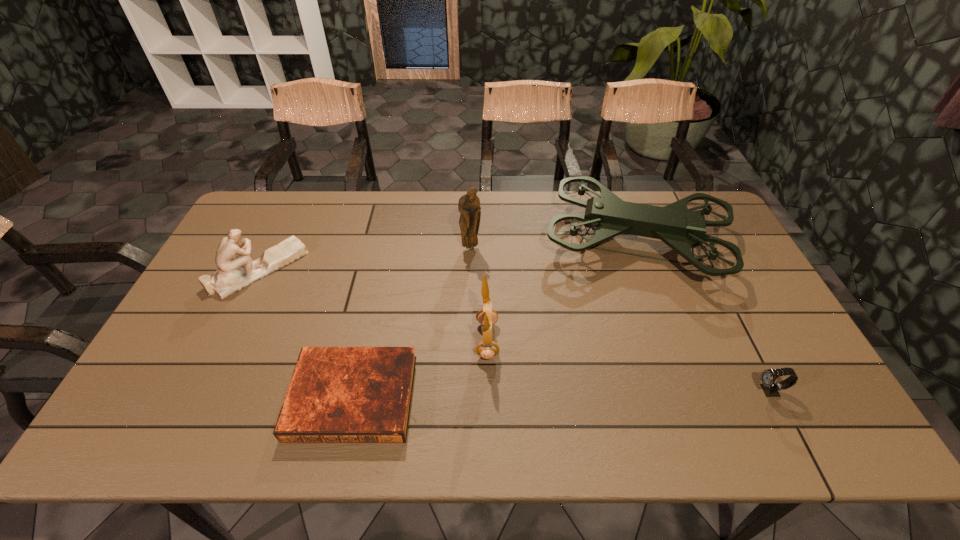
You are a GUI agent. You are given a task and a screenshot of the screen. Output one action in this format:
    pyautogui.click(x=<x>, y=<y>)
    Task: Click on the object located in the left edge section of the desktop
    
    Given the screenshot: What is the action you would take?
    pyautogui.click(x=236, y=270)

You are a GUI agent. You are given a task and a screenshot of the screen. Output one action in this format:
    pyautogui.click(x=<x>, y=<y>)
    Task: Click on the drone at the right edge
    Image resolution: width=960 pixels, height=540 pixels.
    Given the screenshot: What is the action you would take?
    pyautogui.click(x=607, y=215)

Locate an element on the screen. Image resolution: width=960 pixels, height=540 pixels. watch at the right edge is located at coordinates (768, 377).

At what (x,y) coordinates should I click in order to perform the action: click on object located at the far right corner. Please return your answer as a coordinate pair (x, y). The width and height of the screenshot is (960, 540). Looking at the image, I should click on (607, 215).

The width and height of the screenshot is (960, 540). I want to click on vacant area at the far edge, so click(x=353, y=199).

You are a GUI agent. You are given a task and a screenshot of the screen. Output one action in this format:
    pyautogui.click(x=<x>, y=<y>)
    Task: Click on the free space at the near edge
    This screenshot has width=960, height=540.
    Given the screenshot: What is the action you would take?
    pyautogui.click(x=645, y=411)

The width and height of the screenshot is (960, 540). I want to click on vacant position at the left edge of the desktop, so click(199, 326).

The image size is (960, 540). Find the location of `vacant space at the far right corner of the desktop`. vacant space at the far right corner of the desktop is located at coordinates (715, 228).

I want to click on vacant area that lies between the second shortest object and the earphone, so click(x=629, y=366).

Where is `vacant space that's between the tallest object and the fifth shortest object`? Image resolution: width=960 pixels, height=540 pixels. vacant space that's between the tallest object and the fifth shortest object is located at coordinates (553, 245).